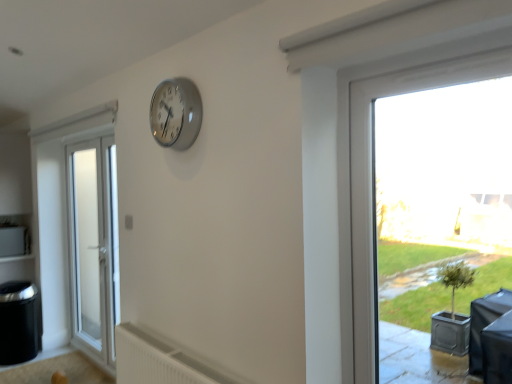
Image resolution: width=512 pixels, height=384 pixels. Describe the element at coordinates (372, 177) in the screenshot. I see `transparent glass window at right` at that location.

Measure the distance between silver metallic clock at upper center and camera.

silver metallic clock at upper center and camera are 6.70 feet apart from each other.

Find the location of a particular element. Image resolution: width=512 pixels, height=384 pixels. transparent glass window at right is located at coordinates (372, 177).

Locate an element on the screen. The height and width of the screenshot is (384, 512). radiator located underneath the white frosted glass door at left (from a real-world perspective) is located at coordinates click(156, 361).

From the picture: Considering the relative sizes of white frosted glass door at left and white plastic radiator at lower center in the image provided, is white frosted glass door at left bigger than white plastic radiator at lower center?

Yes, white frosted glass door at left is bigger than white plastic radiator at lower center.

In the scene shown: Considering the relative positions of white frosted glass door at left and white plastic radiator at lower center in the image provided, is white frosted glass door at left to the left of white plastic radiator at lower center from the viewer's perspective?

Yes, white frosted glass door at left is to the left of white plastic radiator at lower center.

Is white plastic radiator at lower center oriented towards white frosted glass door at left?

No, white plastic radiator at lower center is not oriented towards white frosted glass door at left.

Considering the positions of points (156, 351) and (103, 188), is point (156, 351) closer to camera compared to point (103, 188)?

Yes, point (156, 351) is in front of point (103, 188).

Is white plastic radiator at lower center taller or shorter than white frosted glass door at left?

Considering their sizes, white plastic radiator at lower center has less height than white frosted glass door at left.

From a real-world perspective, relative to white frosted glass door at left, is white plastic radiator at lower center vertically above or below?

Clearly, from a real-world perspective, white plastic radiator at lower center is below white frosted glass door at left.

From a real-world perspective, is silver metallic clock at upper center physically located above or below white plastic radiator at lower center?

silver metallic clock at upper center is above white plastic radiator at lower center.

Does silver metallic clock at upper center come behind white plastic radiator at lower center?

Yes, silver metallic clock at upper center is behind white plastic radiator at lower center.

Is silver metallic clock at upper center not inside white plastic radiator at lower center?

Absolutely, silver metallic clock at upper center is external to white plastic radiator at lower center.

Between point (162, 91) and point (150, 346), which one is positioned behind?

The point (150, 346) is more distant.

Is silver metallic clock at upper center looking in the opposite direction of white frosted glass door at left?

No, silver metallic clock at upper center is not facing away from white frosted glass door at left.

From the image's perspective, is silver metallic clock at upper center under white frosted glass door at left?

No, from the image's perspective, silver metallic clock at upper center is not beneath white frosted glass door at left.

Can you confirm if silver metallic clock at upper center is smaller than white frosted glass door at left?

Yes, silver metallic clock at upper center is smaller than white frosted glass door at left.

From the picture: Is the position of transparent glass window at right less distant than that of silver metallic clock at upper center?

Yes, transparent glass window at right is in front of silver metallic clock at upper center.

Does transparent glass window at right have a lesser width compared to silver metallic clock at upper center?

Indeed, transparent glass window at right has a lesser width compared to silver metallic clock at upper center.

Is transparent glass window at right not close to silver metallic clock at upper center?

transparent glass window at right is near silver metallic clock at upper center, not far away.

What are the coordinates of `window in front of the white frosted glass door at left` in the screenshot? It's located at (372, 177).

Is white frosted glass door at left taller than transparent glass window at right?

Yes, white frosted glass door at left is taller than transparent glass window at right.

Which object is positioned more to the right, white frosted glass door at left or transparent glass window at right?

transparent glass window at right is more to the right.

From the image's perspective, relative to transparent glass window at right, is white frosted glass door at left above or below?

white frosted glass door at left is below transparent glass window at right.

Is transparent glass window at right situated inside white plastic radiator at lower center or outside?

transparent glass window at right lies outside white plastic radiator at lower center.

Looking at the image, does transparent glass window at right seem bigger or smaller compared to white plastic radiator at lower center?

In the image, transparent glass window at right appears to be smaller than white plastic radiator at lower center.

Are transparent glass window at right and white plastic radiator at lower center beside each other?

No, transparent glass window at right is not next to white plastic radiator at lower center.

From the image's perspective, is transparent glass window at right located above white plastic radiator at lower center?

Yes, from the image's perspective, transparent glass window at right is above white plastic radiator at lower center.

Find the location of a particular element. The image size is (512, 384). door lying on the left of white plastic radiator at lower center is located at coordinates (94, 245).

At what (x,y) coordinates should I click in order to perform the action: click on door above the white plastic radiator at lower center (from the image's perspective). Please return your answer as a coordinate pair (x, y). This screenshot has width=512, height=384. Looking at the image, I should click on (94, 245).

Considering their positions, is silver metallic clock at upper center positioned further to transparent glass window at right than white frosted glass door at left?

white frosted glass door at left lies further to transparent glass window at right than the other object.

Considering their positions, is transparent glass window at right positioned further to silver metallic clock at upper center than white frosted glass door at left?

white frosted glass door at left is further to silver metallic clock at upper center.

Based on their spatial positions, is transparent glass window at right or silver metallic clock at upper center closer to white frosted glass door at left?

silver metallic clock at upper center is positioned closer to the anchor white frosted glass door at left.

When comparing their distances from transparent glass window at right, does white plastic radiator at lower center or silver metallic clock at upper center seem further?

The object further to transparent glass window at right is white plastic radiator at lower center.

Estimate the real-world distances between objects in this image. Which object is closer to transparent glass window at right, white frosted glass door at left or silver metallic clock at upper center?

silver metallic clock at upper center lies closer to transparent glass window at right than the other object.

Looking at the image, which one is located closer to white plastic radiator at lower center, white frosted glass door at left or transparent glass window at right?

Among the two, transparent glass window at right is located nearer to white plastic radiator at lower center.

From the image, which object appears to be farther from transparent glass window at right, white plastic radiator at lower center or white frosted glass door at left?

white frosted glass door at left lies further to transparent glass window at right than the other object.

When comparing their distances from silver metallic clock at upper center, does white plastic radiator at lower center or transparent glass window at right seem closer?

The object closer to silver metallic clock at upper center is transparent glass window at right.

The width and height of the screenshot is (512, 384). Identify the location of radiator positioned between transparent glass window at right and white frosted glass door at left from near to far. (156, 361).

Identify the location of clock between transparent glass window at right and white frosted glass door at left from front to back. (176, 113).

The image size is (512, 384). In order to click on clock between white plastic radiator at lower center and white frosted glass door at left along the z-axis in this screenshot , I will do `click(176, 113)`.

You are a GUI agent. You are given a task and a screenshot of the screen. Output one action in this format:
    pyautogui.click(x=<x>, y=<y>)
    Task: Click on the window between silver metallic clock at upper center and white plastic radiator at lower center in the up-down direction
    The image size is (512, 384).
    Given the screenshot: What is the action you would take?
    pyautogui.click(x=372, y=177)